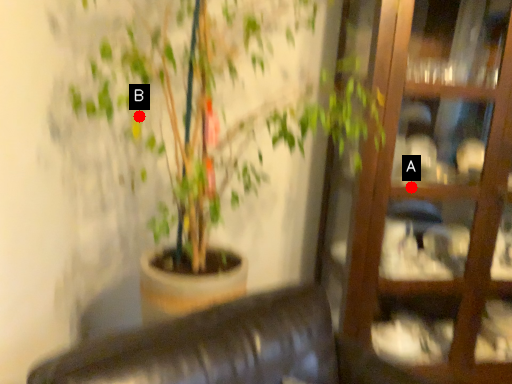
Question: Two points are circled on the image, labeled by A and B beside each circle. Which point is farther to the camera?

Choices:
 (A) A is further
 (B) B is further

Answer: (B)